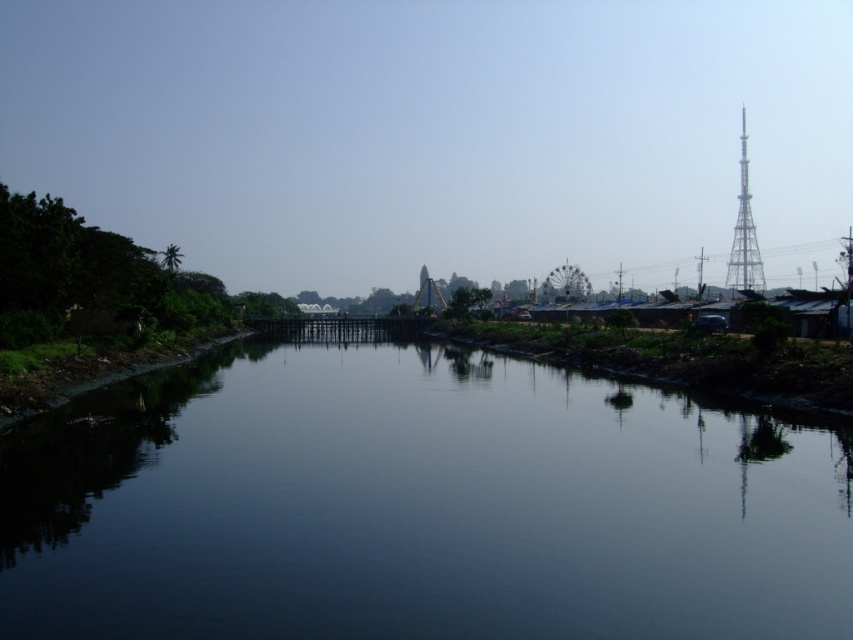
You are a boat captain navigating a narrow canal. You see the dark water at center and the metallic tower at right. Which object is closer to the water surface?

The dark water at center is positioned under the metallic tower at right, so the dark water at center is closer to the water surface than the metallic tower at right.

You are a boat captain navigating a narrow canal. You see the dark water at center and the metallic tower at right in your view. Which object is positioned to the left of the other?

The dark water at center is to the left of the metallic tower at right.

You are a boat operator planning to navigate a vessel through the waterway. The boat requires a minimum of 200 meters of clearance between the dark water at center and the metallic tower at right to safely pass. Can you proceed?

The dark water at center is 218.56 meters from the metallic tower at right, which exceeds the required 200 meters clearance. Therefore, the boat can safely proceed through the waterway.